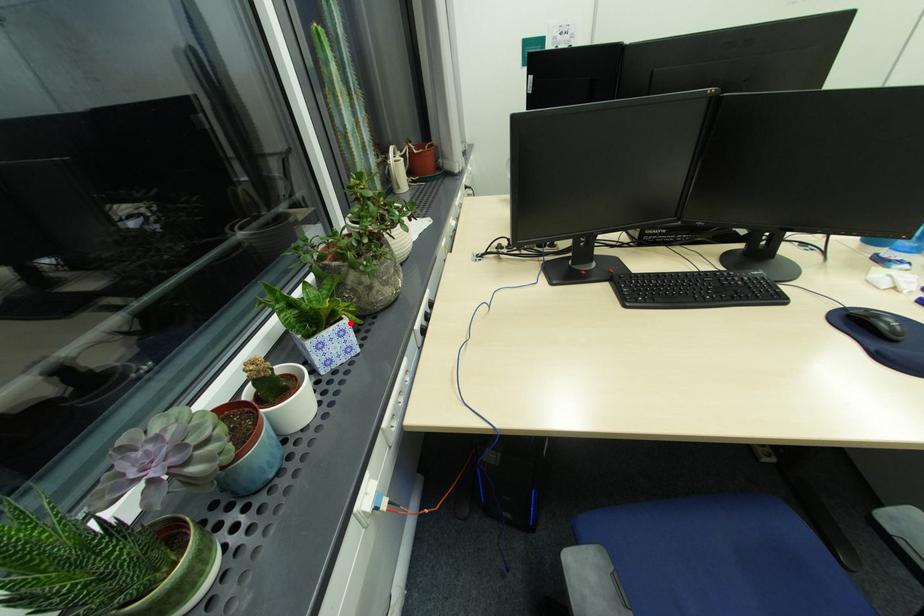
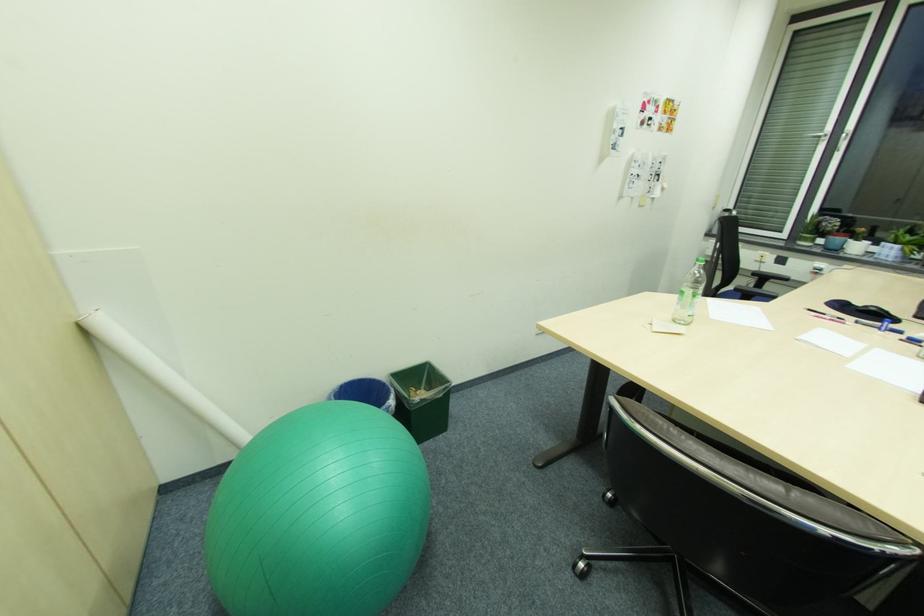
Locate, in the second image, the point that corresponds to the highlighted location in the first image.

(903, 246)